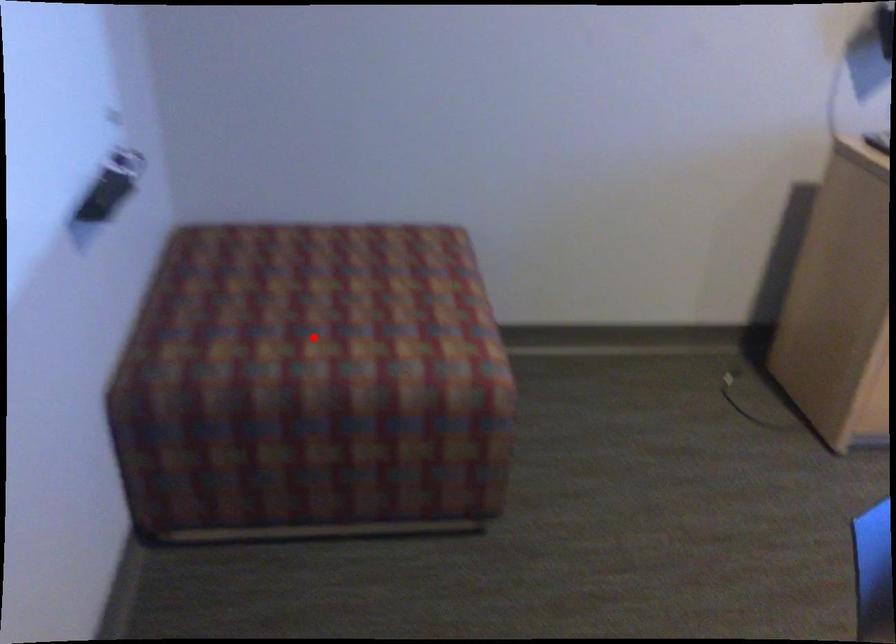
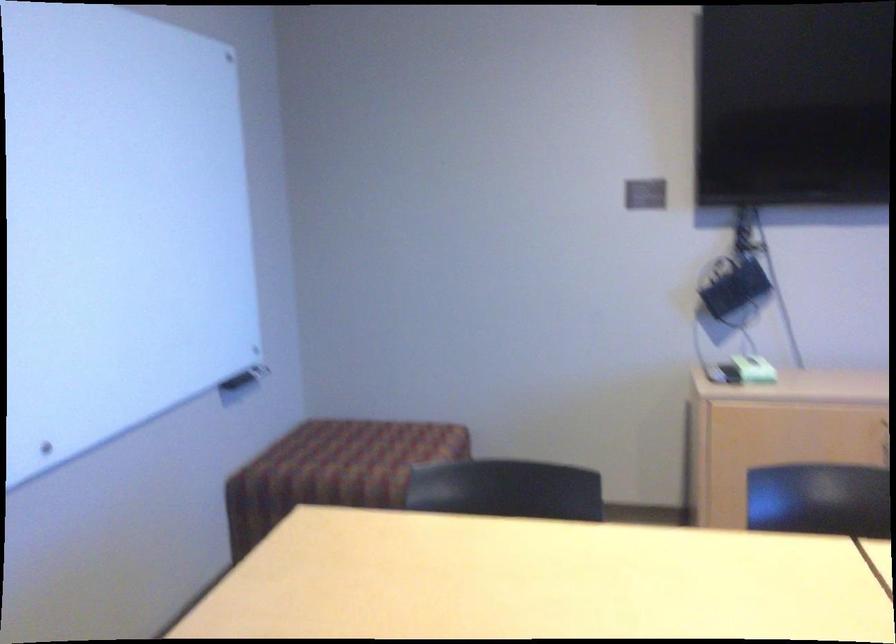
Find the pixel in the second image that matches the highlighted location in the first image.

(331, 465)